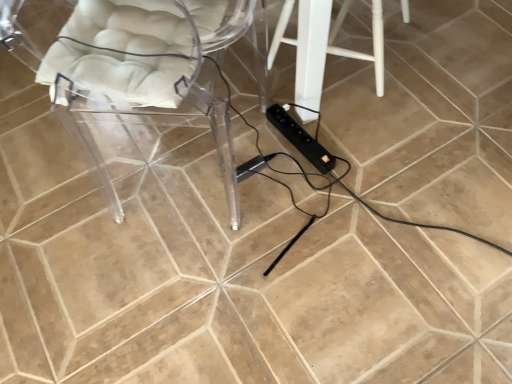
Question: Is white painted wood stool at center directly adjacent to transparent acrylic chair at left?

Choices:
 (A) yes
 (B) no

Answer: (B)

Question: Is white painted wood stool at center looking in the opposite direction of transparent acrylic chair at left?

Choices:
 (A) yes
 (B) no

Answer: (B)

Question: Does white painted wood stool at center appear on the right side of transparent acrylic chair at left?

Choices:
 (A) yes
 (B) no

Answer: (A)

Question: Considering the relative sizes of white painted wood stool at center and transparent acrylic chair at left in the image provided, is white painted wood stool at center thinner than transparent acrylic chair at left?

Choices:
 (A) yes
 (B) no

Answer: (A)

Question: From the image's perspective, is white painted wood stool at center below transparent acrylic chair at left?

Choices:
 (A) yes
 (B) no

Answer: (B)

Question: Is point (269, 66) positioned closer to the camera than point (298, 148)?

Choices:
 (A) farther
 (B) closer

Answer: (A)

Question: Is white painted wood stool at center in front of or behind black plastic extension cord at center, which appears as the first extension cord when viewed from the right, in the image?

Choices:
 (A) front
 (B) behind

Answer: (A)

Question: Is white painted wood stool at center inside or outside of black plastic extension cord at center, the 2th extension cord from the left?

Choices:
 (A) inside
 (B) outside

Answer: (B)

Question: In terms of height, does white painted wood stool at center look taller or shorter compared to black plastic extension cord at center, which appears as the first extension cord when viewed from the right?

Choices:
 (A) short
 (B) tall

Answer: (B)

Question: In the image, is black plastic extension cord at center, which appears as the first extension cord when viewed from the right, positioned in front of or behind transparent acrylic chair at left?

Choices:
 (A) behind
 (B) front

Answer: (A)

Question: In terms of width, does black plastic extension cord at center, which appears as the first extension cord when viewed from the right, look wider or thinner when compared to transparent acrylic chair at left?

Choices:
 (A) wide
 (B) thin

Answer: (B)

Question: From a real-world perspective, is black plastic extension cord at center, the 2th extension cord from the left, physically located above or below transparent acrylic chair at left?

Choices:
 (A) below
 (B) above

Answer: (A)

Question: Choose the correct answer: Is black plastic extension cord at center, the 2th extension cord from the left, inside transparent acrylic chair at left or outside it?

Choices:
 (A) outside
 (B) inside

Answer: (A)

Question: From the image's perspective, is transparent acrylic chair at left located above or below black plastic extension cord at center, which appears as the first extension cord when viewed from the right?

Choices:
 (A) above
 (B) below

Answer: (A)

Question: Is transparent acrylic chair at left bigger or smaller than black plastic extension cord at center, which appears as the first extension cord when viewed from the right?

Choices:
 (A) small
 (B) big

Answer: (B)